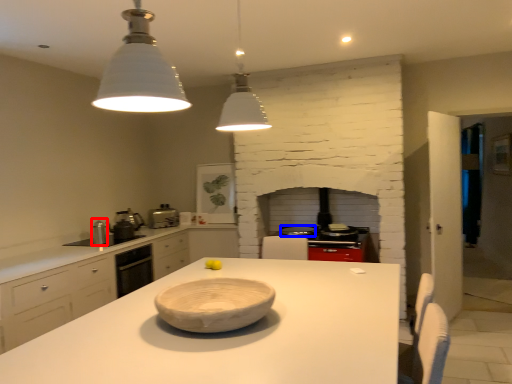
Question: Which object is further to the camera taking this photo, appliance (highlighted by a red box) or appliance (highlighted by a blue box)?

Choices:
 (A) appliance
 (B) appliance

Answer: (B)